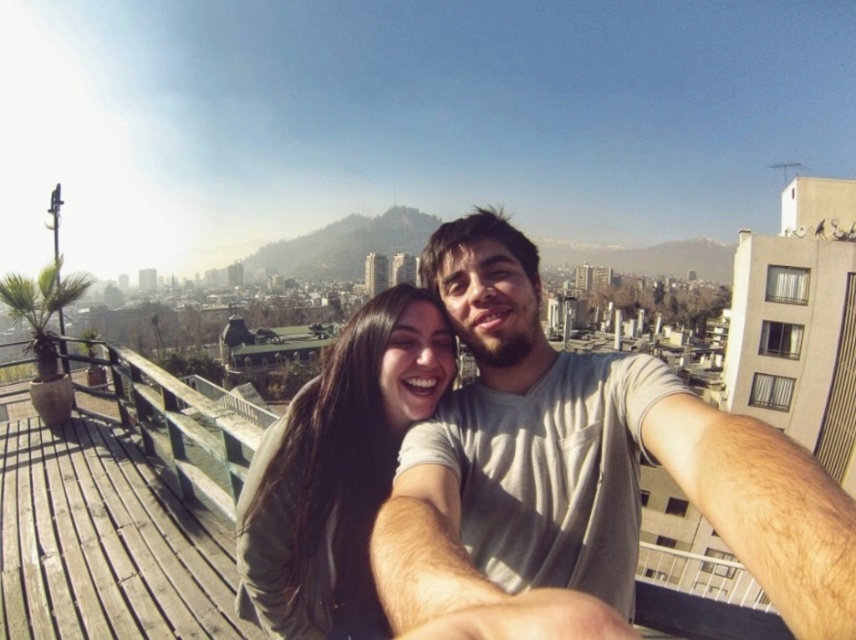
Which is behind, point (771, 448) or point (330, 596)?

The point (330, 596) is more distant.

Between light gray t-shirt at center and matte green sweater at center, which one has more height?

light gray t-shirt at center is taller.

Locate an element on the screen. This screenshot has width=856, height=640. light gray t-shirt at center is located at coordinates (586, 465).